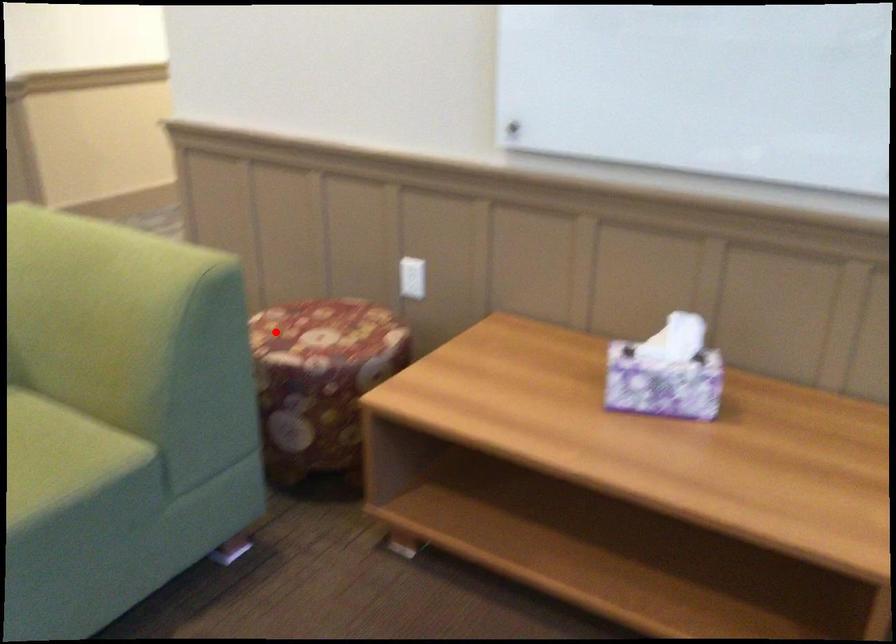
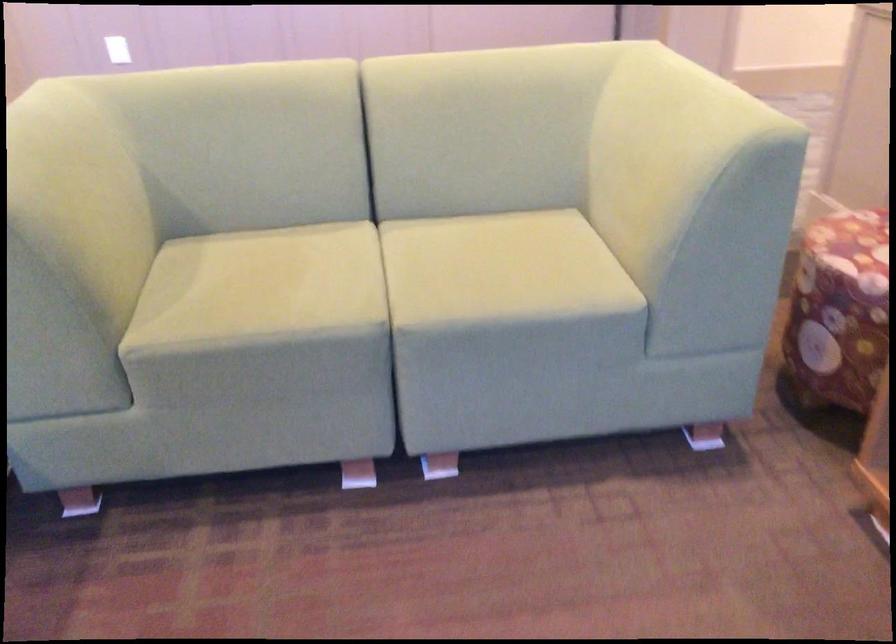
Where in the second image is the point corresponding to the highlighted location from the first image?

(851, 231)